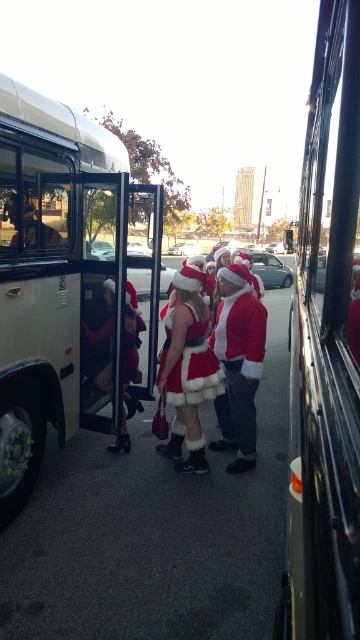
From the picture: You are a photographer standing 10 feet away from the bus. You want to take a photo of both the fuzzy red santa at center and the fuzzy white santa suit at center in the same frame. Can you fit both subjects into the photo without moving closer or further away?

The distance between the fuzzy red santa at center and the fuzzy white santa suit at center is 13.21 inches. Since you are 10 feet away, the field of view of most cameras at this distance can easily accommodate both subjects within the frame. Therefore, you can fit both subjects into the photo without needing to adjust your position.

Where is the fuzzy red santa at center located in the image?

The fuzzy red santa at center is located at point (187, 369).

You are a delivery drone trying to deliver a package to the white matte bus at center. The GPS coordinates of the bus are at point 0.442, 0.178. If your current position is at point 0.5, 0.5, can you fly directly to the bus without any obstacles?

The white matte bus at center is located at point (64, 282). Since the scene description mentions that the bus doors are open and there are people boarding, there might be obstacles such as people or their accessories in the way. However, the GPS coordinates provided do not account for obstacles, so the drone can fly directly to the bus at those coordinates, but must be cautious of any people or objects in the path.